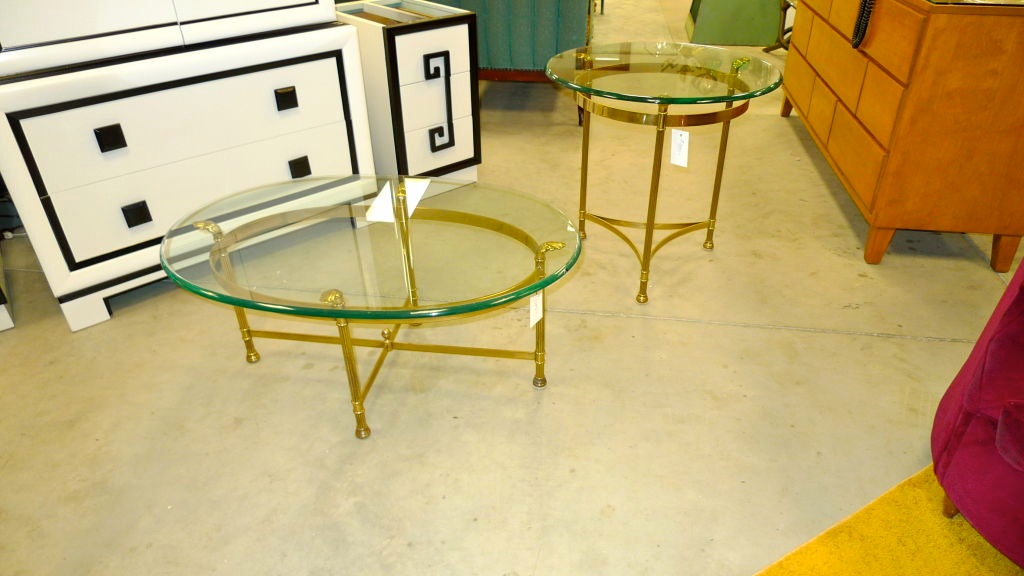
Identify the location of coffee table bracing. This screenshot has width=1024, height=576. (375, 369), (470, 352).